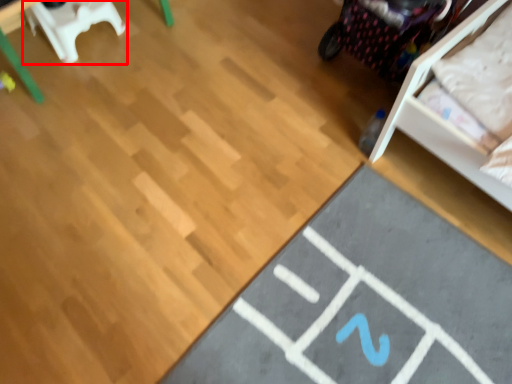
Question: From the image's perspective, what is the correct spatial relationship of furniture (annotated by the red box) in relation to yoga mat?

Choices:
 (A) above
 (B) below

Answer: (A)